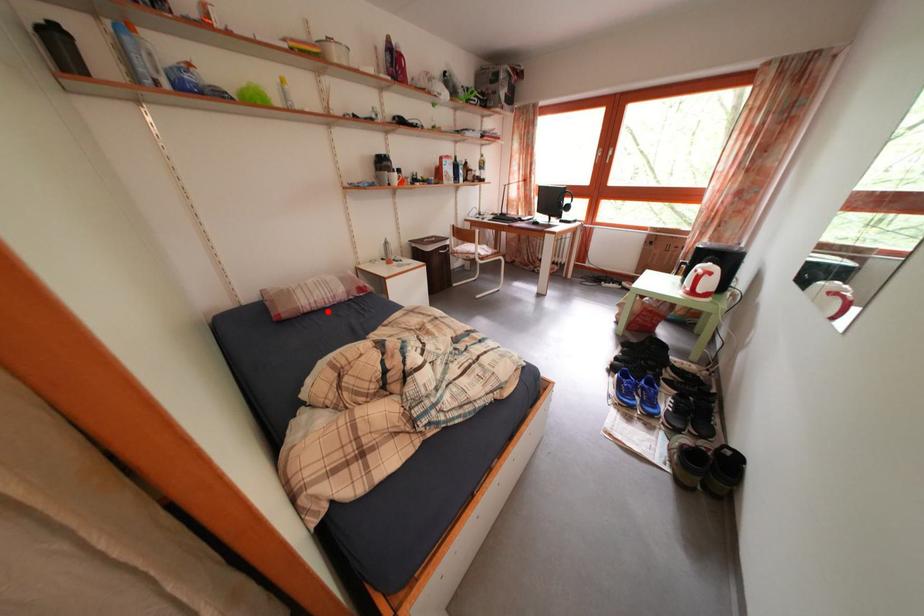
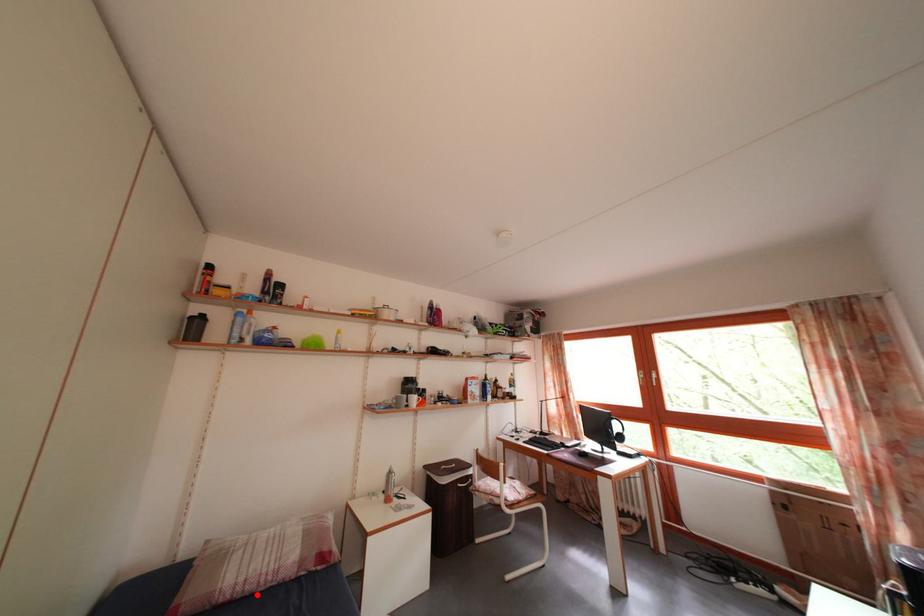
I am providing you with two images of the same scene from different viewpoints. A red point is marked on the first image and another point is marked on the second image. Do the highlighted points in image1 and image2 indicate the same real-world spot?

Yes